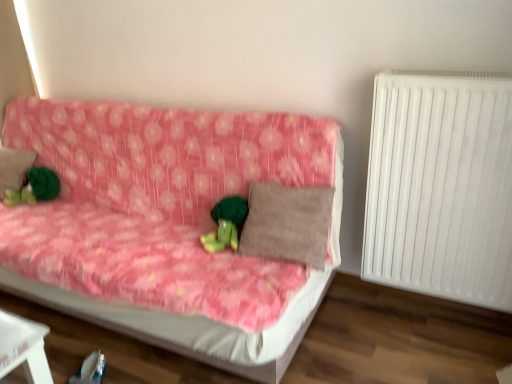
Question: Is white plastic radiator at right surrounding green plush toy at center, which is the 1th toy from right to left?

Choices:
 (A) no
 (B) yes

Answer: (A)

Question: Can you confirm if white plastic radiator at right is bigger than green plush toy at center, which is the 1th toy from right to left?

Choices:
 (A) no
 (B) yes

Answer: (B)

Question: From a real-world perspective, is white plastic radiator at right under green plush toy at center, which is the 1th toy from right to left?

Choices:
 (A) yes
 (B) no

Answer: (B)

Question: Considering the relative positions of white plastic radiator at right and green plush toy at center, positioned as the 2th toy in left-to-right order, in the image provided, is white plastic radiator at right to the left of green plush toy at center, positioned as the 2th toy in left-to-right order, from the viewer's perspective?

Choices:
 (A) no
 (B) yes

Answer: (A)

Question: From the image's perspective, is white plastic radiator at right below green plush toy at center, the 2th toy from the back?

Choices:
 (A) yes
 (B) no

Answer: (B)

Question: From a real-world perspective, is green plush toy at center, which is the 1th toy from right to left, physically located above or below white plastic radiator at right?

Choices:
 (A) above
 (B) below

Answer: (B)

Question: Considering their positions, is green plush toy at center, the 2th toy from the back, located in front of or behind white plastic radiator at right?

Choices:
 (A) front
 (B) behind

Answer: (B)

Question: From the image's perspective, is green plush toy at center, which is the 1th toy from right to left, located above or below white plastic radiator at right?

Choices:
 (A) above
 (B) below

Answer: (B)

Question: Is green plush toy at center, positioned as the 2th toy in left-to-right order, situated inside white plastic radiator at right or outside?

Choices:
 (A) inside
 (B) outside

Answer: (B)

Question: Is green plush toy at left, the second toy in the front-to-back sequence, taller or shorter than brown fabric pillow at left, which is counted as the 1th pillow, starting from the left?

Choices:
 (A) short
 (B) tall

Answer: (A)

Question: Considering the positions of green plush toy at left, acting as the second toy starting from the right, and brown fabric pillow at left, arranged as the first pillow when viewed from the back, in the image, is green plush toy at left, acting as the second toy starting from the right, bigger or smaller than brown fabric pillow at left, arranged as the first pillow when viewed from the back,?

Choices:
 (A) small
 (B) big

Answer: (A)

Question: Does point (51, 187) appear closer or farther from the camera than point (25, 150)?

Choices:
 (A) closer
 (B) farther

Answer: (A)

Question: From the image's perspective, is green plush toy at left, the first toy from the left, above or below brown fabric pillow at left, arranged as the first pillow when viewed from the back?

Choices:
 (A) below
 (B) above

Answer: (A)

Question: Is point (499, 269) closer or farther from the camera than point (26, 175)?

Choices:
 (A) closer
 (B) farther

Answer: (A)

Question: In terms of height, does white plastic radiator at right look taller or shorter compared to brown fabric pillow at left, which is counted as the 1th pillow, starting from the left?

Choices:
 (A) short
 (B) tall

Answer: (B)